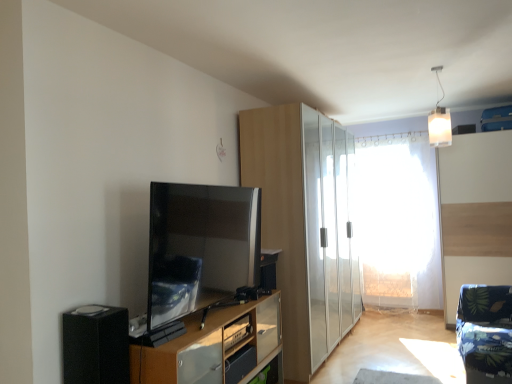
The height and width of the screenshot is (384, 512). Identify the location of light wood cabinet at center. (304, 225).

The height and width of the screenshot is (384, 512). What do you see at coordinates (304, 225) in the screenshot?
I see `light wood cabinet at center` at bounding box center [304, 225].

Describe the element at coordinates (215, 347) in the screenshot. I see `wooden cabinet at lower center` at that location.

Measure the distance between point (212,375) and camera.

The distance of point (212,375) from camera is 7.97 feet.

Describe the element at coordinates (439, 120) in the screenshot. I see `white frosted glass pendant light at upper right` at that location.

What are the coordinates of `light wood cabinet at center` in the screenshot? It's located at (304, 225).

Between wooden cabinet at lower center and black matte speaker at lower left, which one has larger width?

Wider between the two is wooden cabinet at lower center.

Is black matte speaker at lower left inside wooden cabinet at lower center?

No, black matte speaker at lower left is located outside of wooden cabinet at lower center.

Which is more to the left, wooden cabinet at lower center or black matte speaker at lower left?

black matte speaker at lower left.

Is wooden cabinet at lower center not near black matte speaker at lower left?

No.

Is black matte speaker at lower left turned away from white frosted glass pendant light at upper right?

black matte speaker at lower left does not have its back to white frosted glass pendant light at upper right.

Consider the image. From the image's perspective, is black matte speaker at lower left positioned above or below white frosted glass pendant light at upper right?

From the image's perspective, black matte speaker at lower left appears below white frosted glass pendant light at upper right.

How different are the orientations of satin black tv at center and black matte speaker at lower left in degrees?

The facing directions of satin black tv at center and black matte speaker at lower left are 2.09 degrees apart.

Which of these two, satin black tv at center or black matte speaker at lower left, is thinner?

satin black tv at center is thinner.

Does satin black tv at center lie behind black matte speaker at lower left?

Yes, satin black tv at center is behind black matte speaker at lower left.

Considering the sizes of black matte speaker at lower left and satin black tv at center in the image, is black matte speaker at lower left taller or shorter than satin black tv at center?

In the image, black matte speaker at lower left appears to be shorter than satin black tv at center.

From a real-world perspective, is black matte speaker at lower left under satin black tv at center?

Yes.

From the image's perspective, is black matte speaker at lower left below satin black tv at center?

Yes, from the image's perspective, black matte speaker at lower left is beneath satin black tv at center.

Does transparent plastic curtain at center touch satin black tv at center?

No, transparent plastic curtain at center is not with satin black tv at center.

Which object is closer to the camera taking this photo, transparent plastic curtain at center or satin black tv at center?

Positioned in front is satin black tv at center.

Between transparent plastic curtain at center and satin black tv at center, which one has smaller width?

satin black tv at center is thinner.

From a real-world perspective, is transparent plastic curtain at center located beneath satin black tv at center?

Yes, from a real-world perspective, transparent plastic curtain at center is below satin black tv at center.

Looking at the image, does light wood cabinet at center seem bigger or smaller compared to white frosted glass pendant light at upper right?

In the image, light wood cabinet at center appears to be larger than white frosted glass pendant light at upper right.

Between point (350, 302) and point (440, 65), which one is positioned behind?

The point (350, 302) is behind.

Is light wood cabinet at center positioned beyond the bounds of white frosted glass pendant light at upper right?

Yes.

Is white frosted glass pendant light at upper right looking in the opposite direction of wooden cabinet at lower center?

white frosted glass pendant light at upper right is not turned away from wooden cabinet at lower center.

Choose the correct answer: Is white frosted glass pendant light at upper right inside wooden cabinet at lower center or outside it?

The correct answer is: outside.

At what (x,y) coordinates should I click in order to perform the action: click on appliance on the left of wooden cabinet at lower center. Please return your answer as a coordinate pair (x, y). Looking at the image, I should click on (96, 345).

This screenshot has width=512, height=384. I want to click on light fixture behind the black matte speaker at lower left, so click(x=439, y=120).

Estimate the real-world distances between objects in this image. Which object is closer to transparent plastic curtain at center, wooden cabinet at lower center or light wood cabinet at center?

light wood cabinet at center is closer to transparent plastic curtain at center.

Looking at this image, looking at the image, which one is located closer to black matte speaker at lower left, white frosted glass pendant light at upper right or transparent plastic curtain at center?

Among the two, white frosted glass pendant light at upper right is located nearer to black matte speaker at lower left.

Based on their spatial positions, is satin black tv at center or white frosted glass pendant light at upper right closer to wooden cabinet at lower center?

satin black tv at center lies closer to wooden cabinet at lower center than the other object.

Based on their spatial positions, is white frosted glass pendant light at upper right or transparent plastic curtain at center closer to light wood cabinet at center?

→ white frosted glass pendant light at upper right lies closer to light wood cabinet at center than the other object.

Based on their spatial positions, is satin black tv at center or transparent plastic curtain at center closer to black matte speaker at lower left?

satin black tv at center is positioned closer to the anchor black matte speaker at lower left.

Estimate the real-world distances between objects in this image. Which object is further from white frosted glass pendant light at upper right, black matte speaker at lower left or wooden cabinet at lower center?

black matte speaker at lower left is further to white frosted glass pendant light at upper right.

From the image, which object appears to be nearer to wooden cabinet at lower center, transparent plastic curtain at center or white frosted glass pendant light at upper right?

Based on the image, white frosted glass pendant light at upper right appears to be nearer to wooden cabinet at lower center.

Looking at the image, which one is located further to white frosted glass pendant light at upper right, wooden cabinet at lower center or transparent plastic curtain at center?

Based on the image, transparent plastic curtain at center appears to be further to white frosted glass pendant light at upper right.

Find the location of a particular element. Image resolution: width=512 pixels, height=384 pixels. cupboard between black matte speaker at lower left and light wood cabinet at center from front to back is located at coordinates (215, 347).

Image resolution: width=512 pixels, height=384 pixels. In order to click on cupboard between black matte speaker at lower left and transparent plastic curtain at center along the z-axis in this screenshot , I will do `click(215, 347)`.

Locate an element on the screen. cabinetry positioned between white frosted glass pendant light at upper right and transparent plastic curtain at center from near to far is located at coordinates (304, 225).

The height and width of the screenshot is (384, 512). In order to click on cabinetry between white frosted glass pendant light at upper right and wooden cabinet at lower center vertically in this screenshot , I will do `click(304, 225)`.